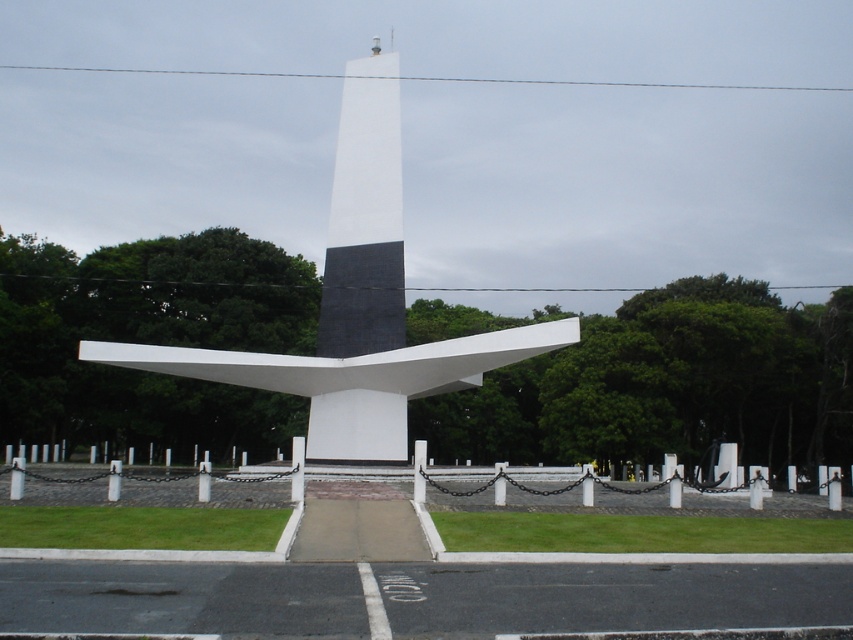
Question: Where is white polished stone obelisk at center located in relation to white smooth tower at center in the image?

Choices:
 (A) right
 (B) left

Answer: (B)

Question: Is white polished stone obelisk at center to the left of white smooth tower at center from the viewer's perspective?

Choices:
 (A) no
 (B) yes

Answer: (B)

Question: Is white polished stone obelisk at center wider than white smooth tower at center?

Choices:
 (A) no
 (B) yes

Answer: (B)

Question: Which object appears farthest from the camera in this image?

Choices:
 (A) white smooth tower at center
 (B) white polished stone obelisk at center

Answer: (A)

Question: Which of the following is the farthest from the observer?

Choices:
 (A) white polished stone obelisk at center
 (B) white smooth tower at center

Answer: (B)